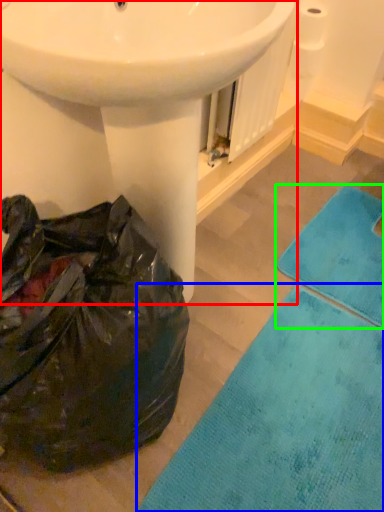
Question: Estimate the real-world distances between objects in this image. Which object is farther from sink (highlighted by a red box), bath mat (highlighted by a blue box) or bath towel (highlighted by a green box)?

Choices:
 (A) bath mat
 (B) bath towel

Answer: (B)